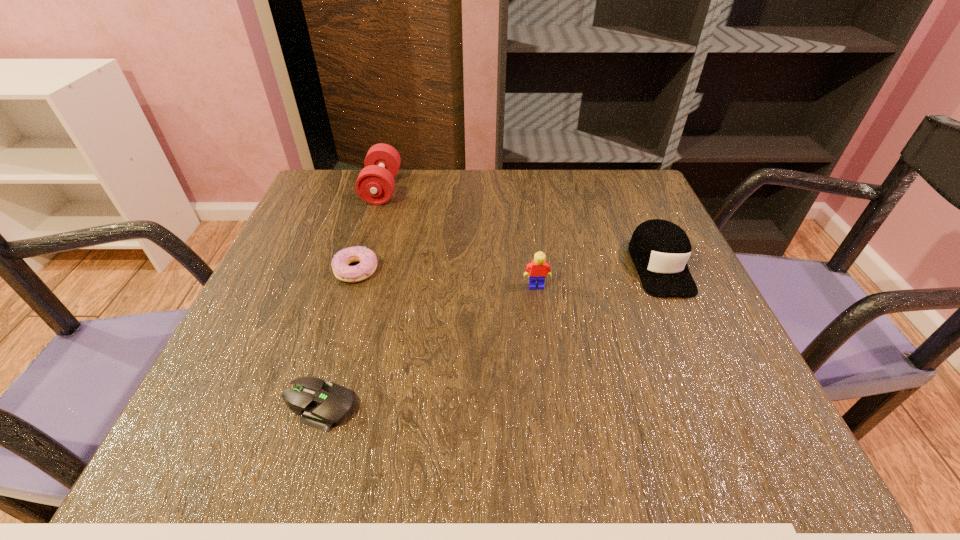
The height and width of the screenshot is (540, 960). In order to click on the farthest object in this screenshot , I will do `click(375, 184)`.

Where is `Lego`? Lego is located at coordinates (538, 268).

You are a GUI agent. You are given a task and a screenshot of the screen. Output one action in this format:
    pyautogui.click(x=<x>, y=<y>)
    Task: Click on the cap
    Image resolution: width=960 pixels, height=540 pixels.
    Given the screenshot: What is the action you would take?
    pyautogui.click(x=660, y=249)

Where is `the second shortest object`? Image resolution: width=960 pixels, height=540 pixels. the second shortest object is located at coordinates (368, 261).

Identify the location of the shortest object. This screenshot has height=540, width=960. (322, 404).

Where is `computer mouse`? Image resolution: width=960 pixels, height=540 pixels. computer mouse is located at coordinates (322, 404).

Find the location of a particular element. blank area located on the right of the farthest object is located at coordinates click(x=462, y=188).

Locate an element on the screen. The width and height of the screenshot is (960, 540). free space located on the front-facing side of the second object from right to left is located at coordinates [x=544, y=343].

This screenshot has height=540, width=960. What are the coordinates of `free space located on the front-facing side of the cap` in the screenshot? It's located at (699, 355).

Where is `free space located 0.280m on the back of the fourth tallest object`? This screenshot has height=540, width=960. free space located 0.280m on the back of the fourth tallest object is located at coordinates 382,185.